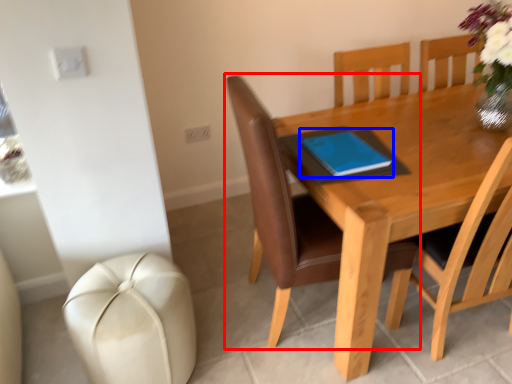
Question: Among these objects, which one is farthest to the camera, chair (highlighted by a red box) or notebook (highlighted by a blue box)?

Choices:
 (A) chair
 (B) notebook

Answer: (B)